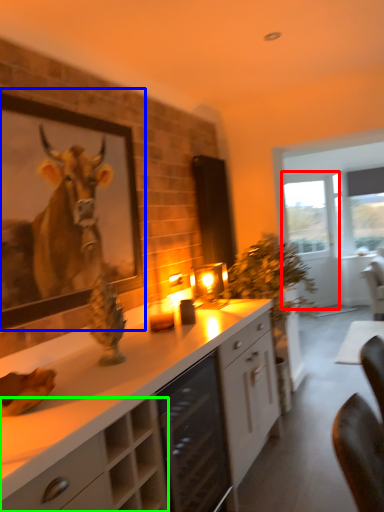
Question: Which is farther away from glass door (highlighted by a red box)? picture frame (highlighted by a blue box) or cabinetry (highlighted by a green box)?

Choices:
 (A) picture frame
 (B) cabinetry

Answer: (B)